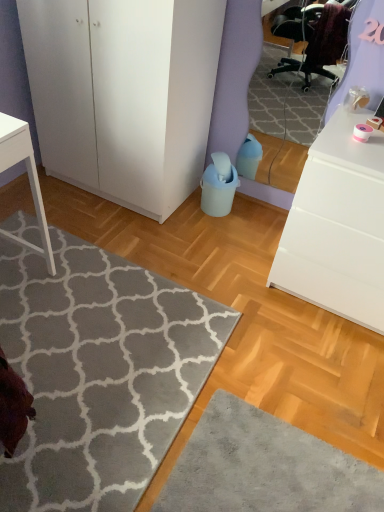
Where is `free space in front of white matte cabinet at left`? The image size is (384, 512). free space in front of white matte cabinet at left is located at coordinates (127, 231).